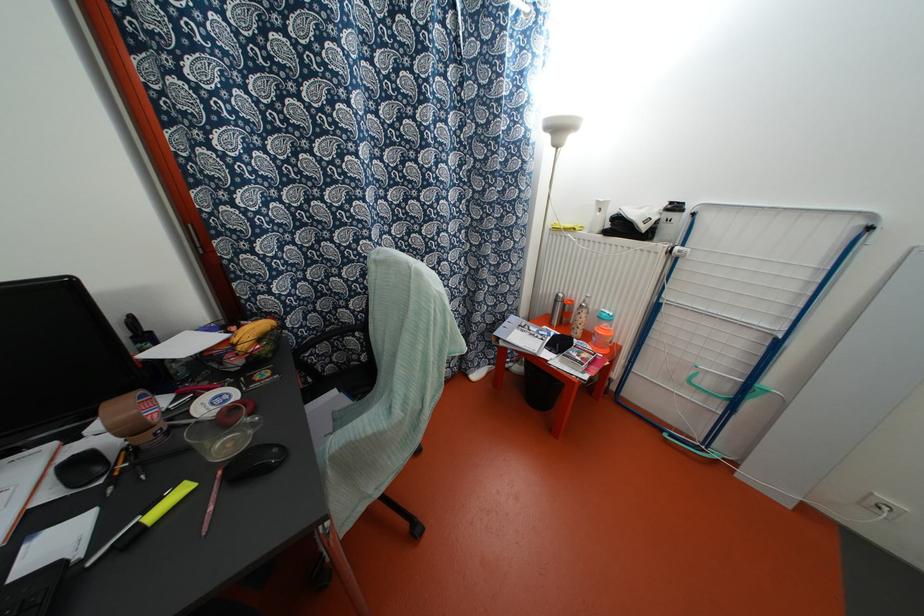
Find the location of a particular element. yellow highlighter pen is located at coordinates (155, 514).